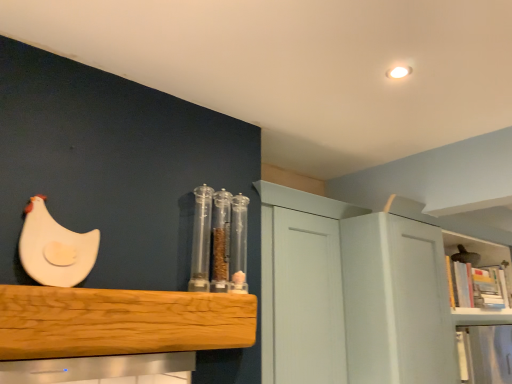
This screenshot has height=384, width=512. Describe the element at coordinates (353, 293) in the screenshot. I see `white matte cabinet at upper right` at that location.

Describe the element at coordinates (479, 288) in the screenshot. The height and width of the screenshot is (384, 512). I see `wooden bookshelf at upper right, positioned as the 1th shelf in back-to-front order` at that location.

Find the location of a particular element. The image size is (512, 384). white matte chicken at left, the second chicken viewed from the back is located at coordinates (55, 248).

Measure the distance between white matte chicken at left, marked as the 2th chicken in a bottom-to-top arrangement, and camera.

white matte chicken at left, marked as the 2th chicken in a bottom-to-top arrangement, and camera are 1.18 meters apart.

Measure the distance between natural wood shelf at center, arranged as the 2th shelf when viewed from the right, and camera.

3.44 feet.

Locate an element on the screen. white matte cabinet at upper right is located at coordinates (353, 293).

Is white matte cabinet at upper right not within white matte chicken at left, arranged as the 1th chicken when viewed from the front?

Yes, white matte cabinet at upper right is outside of white matte chicken at left, arranged as the 1th chicken when viewed from the front.

What's the angular difference between white matte cabinet at upper right and white matte chicken at left, which is the 1th chicken in left-to-right order,'s facing directions?

The angle between the facing direction of white matte cabinet at upper right and the facing direction of white matte chicken at left, which is the 1th chicken in left-to-right order, is 0.463 degrees.

Is white matte cabinet at upper right smaller than white matte chicken at left, marked as the 2th chicken in a bottom-to-top arrangement?

Actually, white matte cabinet at upper right might be larger than white matte chicken at left, marked as the 2th chicken in a bottom-to-top arrangement.

Is point (32, 201) positioned behind point (244, 210)?

No.

Which object is positioned more to the right, white matte chicken at left, marked as the 2th chicken in a bottom-to-top arrangement, or transparent plastic containers at center?

transparent plastic containers at center is more to the right.

What's the angular difference between white matte chicken at left, the 1th chicken from the top, and transparent plastic containers at center's facing directions?

The angle between the facing direction of white matte chicken at left, the 1th chicken from the top, and the facing direction of transparent plastic containers at center is 0.0427 degrees.

From a real-world perspective, who is located higher, white matte chicken at left, arranged as the 1th chicken when viewed from the front, or transparent plastic containers at center?

transparent plastic containers at center is physically above.

From a real-world perspective, is white matte chicken at left, arranged as the 1th chicken when viewed from the front, beneath white matte chicken at upper left, the 1th chicken when ordered from back to front?

Indeed, from a real-world perspective, white matte chicken at left, arranged as the 1th chicken when viewed from the front, is positioned beneath white matte chicken at upper left, the 1th chicken when ordered from back to front.

Is white matte chicken at left, placed as the 2th chicken when sorted from right to left, next to white matte chicken at upper left, marked as the second chicken in a front-to-back arrangement?

white matte chicken at left, placed as the 2th chicken when sorted from right to left, is not next to white matte chicken at upper left, marked as the second chicken in a front-to-back arrangement, and they're not touching.

Between white matte chicken at left, the 1th chicken from the top, and white matte chicken at upper left, which is the second chicken in left-to-right order, which one has larger size?

Bigger between the two is white matte chicken at upper left, which is the second chicken in left-to-right order.

Considering the positions of points (36, 268) and (469, 258), is point (36, 268) closer to camera compared to point (469, 258)?

Yes.

Is white matte cabinet at upper right at the back of white matte chicken at left, the 1th chicken from the top?

That's not correct — white matte chicken at left, the 1th chicken from the top, is not looking away from white matte cabinet at upper right.

Based on the photo, which object is further away from the camera taking this photo, white matte chicken at left, which is the 1th chicken in left-to-right order, or white matte cabinet at upper right?

white matte cabinet at upper right is further from the camera.

Is white matte chicken at left, placed as the 2th chicken when sorted from right to left, far from white matte cabinet at upper right?

white matte chicken at left, placed as the 2th chicken when sorted from right to left, is positioned a significant distance from white matte cabinet at upper right.

From a real-world perspective, is white matte chicken at left, the second chicken viewed from the back, above or below white matte cabinet at upper right?

white matte chicken at left, the second chicken viewed from the back, is situated higher than white matte cabinet at upper right in the real world.

From the image's perspective, is white matte cabinet at upper right on top of natural wood shelf at center, which ranks as the second shelf in back-to-front order?

No, from the image's perspective, white matte cabinet at upper right is not over natural wood shelf at center, which ranks as the second shelf in back-to-front order.

Is white matte cabinet at upper right with natural wood shelf at center, the first shelf in the front-to-back sequence?

No, white matte cabinet at upper right is not beside natural wood shelf at center, the first shelf in the front-to-back sequence.

Does white matte cabinet at upper right come in front of natural wood shelf at center, which ranks as the 1th shelf in left-to-right order?

No, white matte cabinet at upper right is further to the viewer.

Is natural wood shelf at center, arranged as the 2th shelf when viewed from the right, inside transparent plastic containers at center?

Actually, natural wood shelf at center, arranged as the 2th shelf when viewed from the right, is outside transparent plastic containers at center.

Who is shorter, transparent plastic containers at center or natural wood shelf at center, the first shelf in the front-to-back sequence?

natural wood shelf at center, the first shelf in the front-to-back sequence, is shorter.

Does transparent plastic containers at center appear on the left side of natural wood shelf at center, arranged as the 2th shelf when viewed from the right?

No, transparent plastic containers at center is not to the left of natural wood shelf at center, arranged as the 2th shelf when viewed from the right.

From the image's perspective, which is above, transparent plastic containers at center or natural wood shelf at center, arranged as the 2th shelf when viewed from the right?

transparent plastic containers at center appears higher in the image.

Who is shorter, wooden bookshelf at upper right, the 1th shelf positioned from the right, or white matte chicken at upper left, the 1th chicken when ordered from back to front?

white matte chicken at upper left, the 1th chicken when ordered from back to front, is shorter.

Which of these two, wooden bookshelf at upper right, the 2th shelf viewed from the front, or white matte chicken at upper left, marked as the second chicken in a front-to-back arrangement, is smaller?

With smaller size is white matte chicken at upper left, marked as the second chicken in a front-to-back arrangement.

This screenshot has width=512, height=384. I want to click on chicken that is behind the wooden bookshelf at upper right, which ranks as the 2th shelf in left-to-right order, so click(466, 256).

From a real-world perspective, does wooden bookshelf at upper right, the 2th shelf viewed from the front, sit lower than white matte chicken at upper left, placed as the second chicken when sorted from top to bottom?

Yes, from a real-world perspective, wooden bookshelf at upper right, the 2th shelf viewed from the front, is under white matte chicken at upper left, placed as the second chicken when sorted from top to bottom.

Locate an element on the screen. chicken that is the 2nd object located above the white matte cabinet at upper right (from the image's perspective) is located at coordinates (55, 248).

At what (x,y) coordinates should I click in order to perform the action: click on chicken directly beneath the transparent plastic containers at center (from a real-world perspective). Please return your answer as a coordinate pair (x, y). The width and height of the screenshot is (512, 384). Looking at the image, I should click on (55, 248).

Looking at the image, which one is located closer to transparent plastic containers at center, white matte chicken at left, the second chicken viewed from the back, or white matte cabinet at upper right?

white matte chicken at left, the second chicken viewed from the back, is positioned closer to the anchor transparent plastic containers at center.

Estimate the real-world distances between objects in this image. Which object is closer to white matte chicken at upper left, acting as the first chicken starting from the bottom, white matte cabinet at upper right or wooden bookshelf at upper right, which ranks as the 2th shelf in left-to-right order?

The object closer to white matte chicken at upper left, acting as the first chicken starting from the bottom, is wooden bookshelf at upper right, which ranks as the 2th shelf in left-to-right order.

When comparing their distances from white matte chicken at upper left, placed as the second chicken when sorted from top to bottom, does white matte cabinet at upper right or white matte chicken at left, marked as the 2th chicken in a bottom-to-top arrangement, seem further?

The object further to white matte chicken at upper left, placed as the second chicken when sorted from top to bottom, is white matte chicken at left, marked as the 2th chicken in a bottom-to-top arrangement.

Considering their positions, is transparent plastic containers at center positioned closer to wooden bookshelf at upper right, which ranks as the 2th shelf in left-to-right order, than white matte chicken at upper left, the 1th chicken when ordered from back to front?

white matte chicken at upper left, the 1th chicken when ordered from back to front, is closer to wooden bookshelf at upper right, which ranks as the 2th shelf in left-to-right order.

Looking at this image, considering their positions, is natural wood shelf at center, arranged as the 2th shelf when viewed from the right, positioned closer to white matte chicken at upper left, which is the second chicken in left-to-right order, than transparent plastic containers at center?

Based on the image, transparent plastic containers at center appears to be nearer to white matte chicken at upper left, which is the second chicken in left-to-right order.

Which object lies further to the anchor point natural wood shelf at center, which ranks as the second shelf in back-to-front order, wooden bookshelf at upper right, the 2th shelf viewed from the front, or white matte chicken at upper left, acting as the first chicken starting from the bottom?

Among the two, white matte chicken at upper left, acting as the first chicken starting from the bottom, is located further to natural wood shelf at center, which ranks as the second shelf in back-to-front order.

Consider the image. Based on their spatial positions, is transparent plastic containers at center or wooden bookshelf at upper right, the 2th shelf viewed from the front, further from white matte chicken at upper left, marked as the second chicken in a front-to-back arrangement?

transparent plastic containers at center.

Estimate the real-world distances between objects in this image. Which object is further from white matte chicken at left, the second chicken viewed from the back, transparent plastic containers at center or white matte cabinet at upper right?

The object further to white matte chicken at left, the second chicken viewed from the back, is white matte cabinet at upper right.

Where is `cabinetry located between transparent plastic containers at center and wooden bookshelf at upper right, the 1th shelf positioned from the right, in the left-right direction`? Image resolution: width=512 pixels, height=384 pixels. cabinetry located between transparent plastic containers at center and wooden bookshelf at upper right, the 1th shelf positioned from the right, in the left-right direction is located at coordinates (353, 293).

I want to click on shelf between white matte cabinet at upper right and white matte chicken at upper left, which is the second chicken in left-to-right order, from front to back, so click(x=479, y=288).

This screenshot has width=512, height=384. What are the coordinates of `cabinetry between transparent plastic containers at center and white matte chicken at upper left, the 1th chicken when ordered from back to front, from left to right` in the screenshot? It's located at (353, 293).

The height and width of the screenshot is (384, 512). I want to click on glass jar between natural wood shelf at center, arranged as the 2th shelf when viewed from the right, and white matte cabinet at upper right from left to right, so click(x=219, y=242).